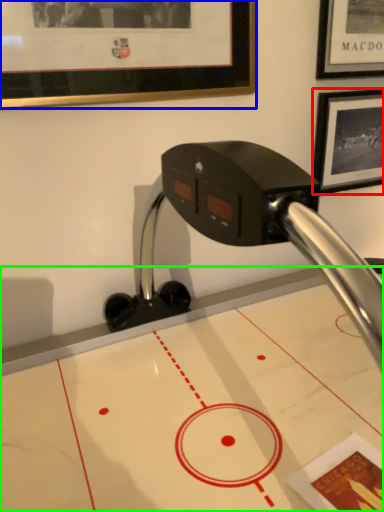
Question: Based on their relative distances, which object is farther from picture frame (highlighted by a red box)? Choose from picture frame (highlighted by a blue box) and table (highlighted by a green box).

Choices:
 (A) picture frame
 (B) table

Answer: (B)